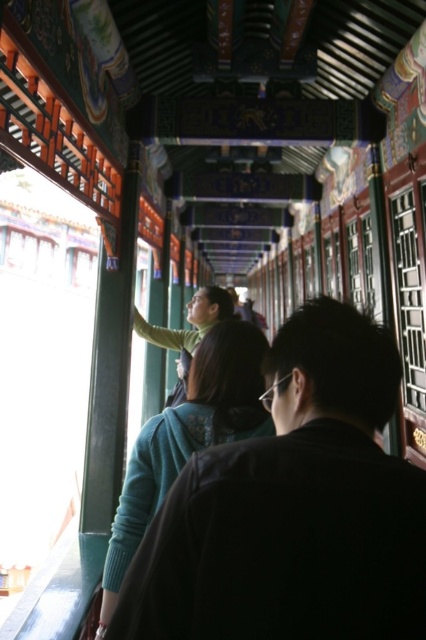
Is black matte jacket at center positioned before teal knitted sweater at center?

Yes, black matte jacket at center is in front of teal knitted sweater at center.

Is point (224, 465) in front of point (204, 371)?

That is True.

You are a GUI agent. You are given a task and a screenshot of the screen. Output one action in this format:
    pyautogui.click(x=<x>, y=<y>)
    Task: Click on the black matte jacket at center
    
    Given the screenshot: What is the action you would take?
    pyautogui.click(x=293, y=508)

Who is taller, teal knitted sweater at center or matte green sweater at center?

With more height is teal knitted sweater at center.

Is teal knitted sweater at center smaller than matte green sweater at center?

Yes, teal knitted sweater at center is smaller than matte green sweater at center.

Is point (138, 444) positioned before point (221, 301)?

Yes, it is in front of point (221, 301).

I want to click on teal knitted sweater at center, so click(x=187, y=438).

Which is below, black matte jacket at center or matte green sweater at center?

black matte jacket at center

Between black matte jacket at center and matte green sweater at center, which one has less height?

With less height is black matte jacket at center.

Who is more distant from viewer, (308, 582) or (175, 339)?

The point (175, 339) is more distant.

You are a GUI agent. You are given a task and a screenshot of the screen. Output one action in this format:
    pyautogui.click(x=<x>, y=<y>)
    Task: Click on the black matte jacket at center
    The width and height of the screenshot is (426, 640).
    Given the screenshot: What is the action you would take?
    pyautogui.click(x=293, y=508)